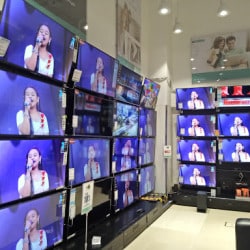
Locate an element on the screen. clear area on the floor is located at coordinates pyautogui.click(x=175, y=233).